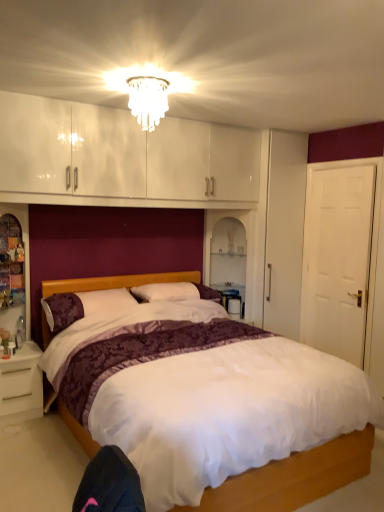
Question: Is purple floral pillow at center oriented towards white glossy nightstand at lower left?

Choices:
 (A) yes
 (B) no

Answer: (B)

Question: Would you consider purple floral pillow at center to be distant from white glossy nightstand at lower left?

Choices:
 (A) no
 (B) yes

Answer: (A)

Question: Does purple floral pillow at center have a larger size compared to white glossy nightstand at lower left?

Choices:
 (A) no
 (B) yes

Answer: (B)

Question: From the image's perspective, is purple floral pillow at center under white glossy nightstand at lower left?

Choices:
 (A) yes
 (B) no

Answer: (B)

Question: Does purple floral pillow at center have a smaller size compared to white glossy nightstand at lower left?

Choices:
 (A) yes
 (B) no

Answer: (B)

Question: From a real-world perspective, does purple floral pillow at center sit lower than white glossy nightstand at lower left?

Choices:
 (A) no
 (B) yes

Answer: (A)

Question: From the image's perspective, is white glossy nightstand at lower left below translucent glass chandelier at upper center?

Choices:
 (A) yes
 (B) no

Answer: (A)

Question: Considering the relative sizes of white glossy nightstand at lower left and translucent glass chandelier at upper center in the image provided, is white glossy nightstand at lower left bigger than translucent glass chandelier at upper center?

Choices:
 (A) no
 (B) yes

Answer: (B)

Question: From a real-world perspective, is white glossy nightstand at lower left positioned under translucent glass chandelier at upper center based on gravity?

Choices:
 (A) yes
 (B) no

Answer: (A)

Question: Can translucent glass chandelier at upper center be found inside white glossy nightstand at lower left?

Choices:
 (A) yes
 (B) no

Answer: (B)

Question: Considering the relative sizes of white glossy nightstand at lower left and translucent glass chandelier at upper center in the image provided, is white glossy nightstand at lower left taller than translucent glass chandelier at upper center?

Choices:
 (A) no
 (B) yes

Answer: (B)

Question: From a real-world perspective, is white glossy nightstand at lower left over translucent glass chandelier at upper center?

Choices:
 (A) yes
 (B) no

Answer: (B)

Question: Does white glossy table at right have a smaller size compared to translucent glass chandelier at upper center?

Choices:
 (A) no
 (B) yes

Answer: (A)